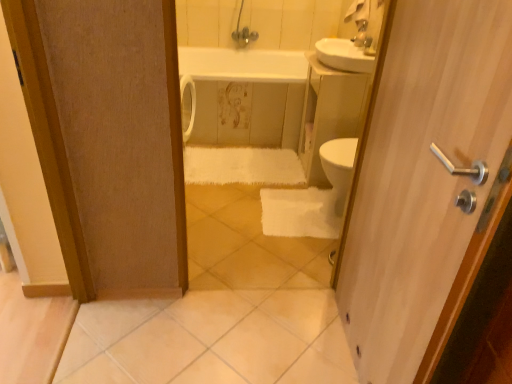
Question: Does wooden door handle at right have a greater width compared to white fluffy bath towel at center?

Choices:
 (A) yes
 (B) no

Answer: (B)

Question: Does wooden door handle at right appear on the right side of white fluffy bath towel at center?

Choices:
 (A) yes
 (B) no

Answer: (A)

Question: Considering the relative positions of wooden door handle at right and white fluffy bath towel at center in the image provided, is wooden door handle at right behind white fluffy bath towel at center?

Choices:
 (A) yes
 (B) no

Answer: (B)

Question: Considering the relative sizes of wooden door handle at right and white fluffy bath towel at center in the image provided, is wooden door handle at right bigger than white fluffy bath towel at center?

Choices:
 (A) no
 (B) yes

Answer: (B)

Question: Can you confirm if wooden door handle at right is thinner than white fluffy bath towel at center?

Choices:
 (A) no
 (B) yes

Answer: (B)

Question: From the image's perspective, is wooden door handle at right below white fluffy bath towel at center?

Choices:
 (A) yes
 (B) no

Answer: (A)

Question: From the image's perspective, would you say metallic silver faucet at upper center is shown under white glossy bathtub at center?

Choices:
 (A) yes
 (B) no

Answer: (B)

Question: Does metallic silver faucet at upper center have a lesser height compared to white glossy bathtub at center?

Choices:
 (A) no
 (B) yes

Answer: (B)

Question: Is metallic silver faucet at upper center not within white glossy bathtub at center?

Choices:
 (A) yes
 (B) no

Answer: (A)

Question: Is white glossy bathtub at center at the back of metallic silver faucet at upper center?

Choices:
 (A) yes
 (B) no

Answer: (B)

Question: Are metallic silver faucet at upper center and white glossy bathtub at center located far from each other?

Choices:
 (A) no
 (B) yes

Answer: (A)

Question: Is metallic silver faucet at upper center positioned behind white glossy bathtub at center?

Choices:
 (A) yes
 (B) no

Answer: (B)

Question: Considering the relative sizes of white glossy bathtub at center and metallic silver faucet at upper center in the image provided, is white glossy bathtub at center smaller than metallic silver faucet at upper center?

Choices:
 (A) no
 (B) yes

Answer: (A)